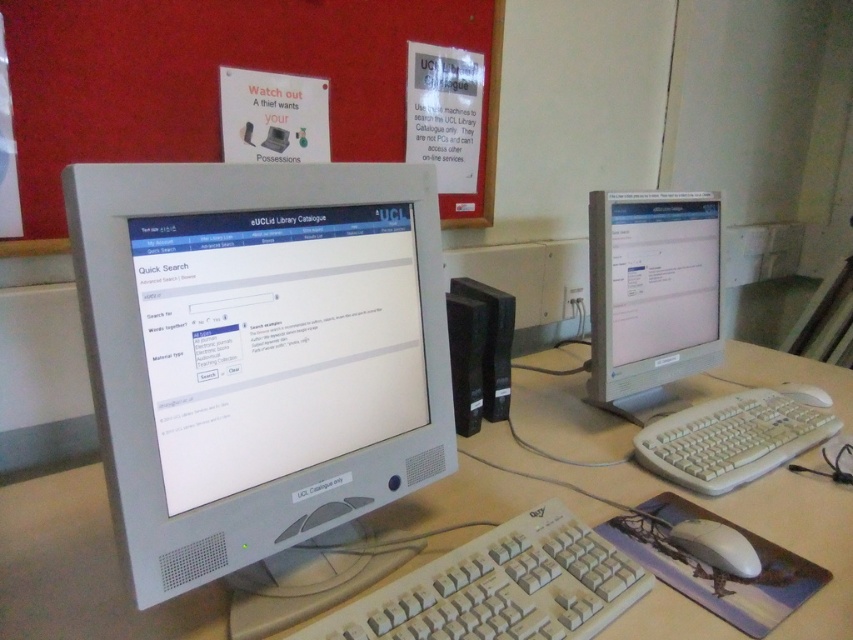
Question: Considering the real-world distances, which object is closest to the beige plastic keyboard at lower center?

Choices:
 (A) red matte bulletin board at upper center
 (B) white plastic mouse at lower right

Answer: (B)

Question: Which object is positioned farthest from the white plastic computer desk at center?

Choices:
 (A) white plastic mouse at lower right
 (B) red matte bulletin board at upper center
 (C) beige plastic keyboard at lower center

Answer: (B)

Question: Can you confirm if white plastic mouse at lower right is smaller than white plastic mouse at center?

Choices:
 (A) yes
 (B) no

Answer: (A)

Question: Does red matte bulletin board at upper center have a greater width compared to white plastic mouse at lower right?

Choices:
 (A) yes
 (B) no

Answer: (A)

Question: Is white plastic computer desk at center to the left of matte silver monitor at right from the viewer's perspective?

Choices:
 (A) no
 (B) yes

Answer: (B)

Question: Which of the following is the farthest from the observer?

Choices:
 (A) matte silver monitor at right
 (B) white plastic computer desk at center

Answer: (A)